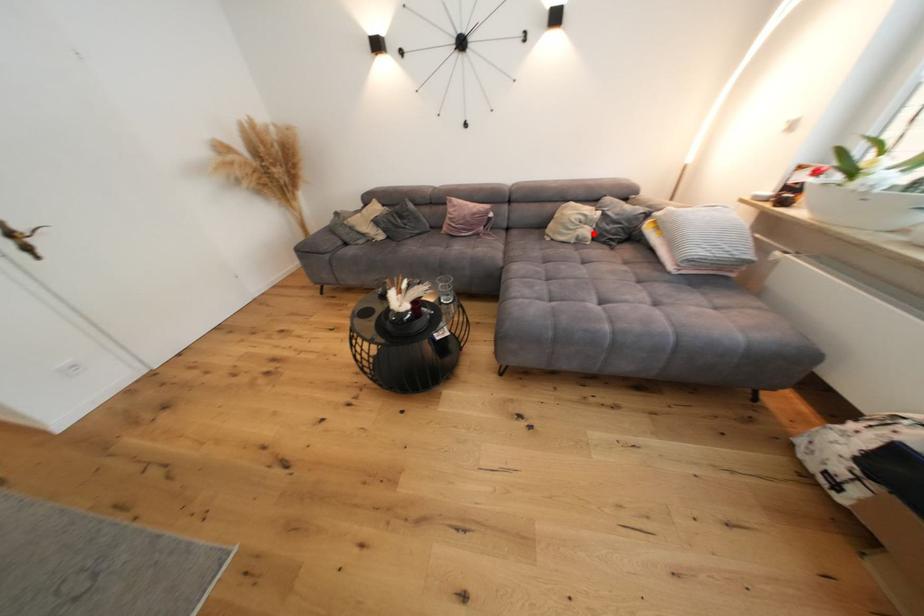
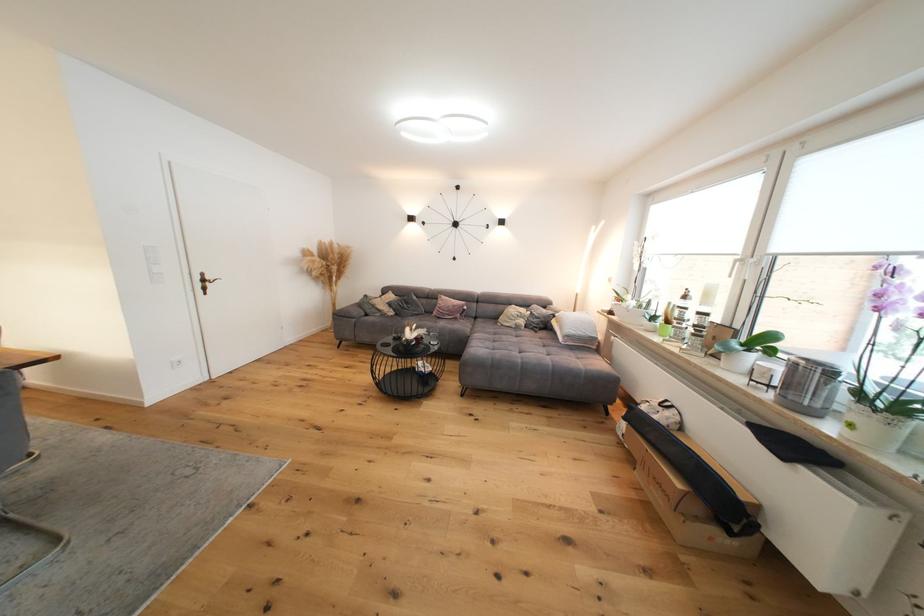
Question: I am providing you with two images of the same scene from different viewpoints. A red point is marked on the first image. Can you still see the location of the red point in image 2?

Choices:
 (A) Yes
 (B) No

Answer: (A)